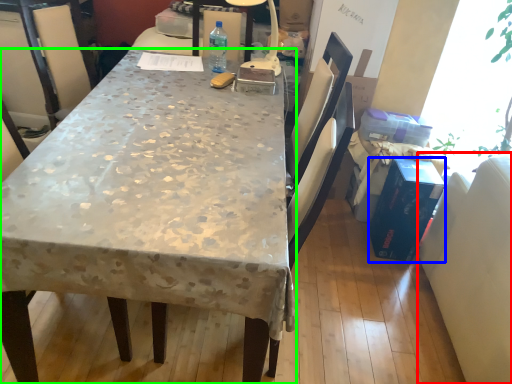
Question: Considering the real-world distances, which object is closest to swivel chair (highlighted by a red box)? box (highlighted by a blue box) or desk (highlighted by a green box).

Choices:
 (A) box
 (B) desk

Answer: (A)